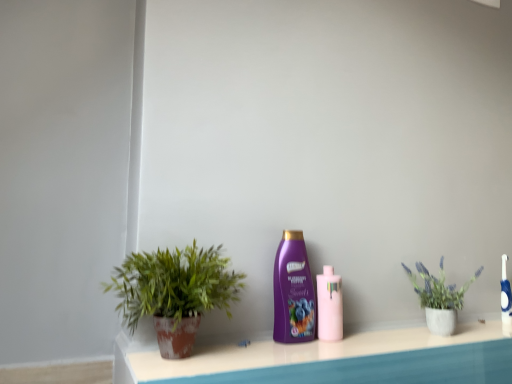
This screenshot has height=384, width=512. I want to click on green matte plant pot at left, which ranks as the second houseplant in right-to-left order, so click(x=174, y=292).

Consider the image. Measure the distance between point (304,275) and camera.

Point (304,275) and camera are 3.55 feet apart from each other.

How much space does purple glossy shampoo at center, placed as the second bottle when sorted from right to left, occupy horizontally?

The width of purple glossy shampoo at center, placed as the second bottle when sorted from right to left, is 2.68 inches.

Image resolution: width=512 pixels, height=384 pixels. I want to click on matte concrete pot at right, positioned as the 1th houseplant in back-to-front order, so click(439, 298).

Where is `pink glossy bottle at center, the first bottle viewed from the right`? The height and width of the screenshot is (384, 512). pink glossy bottle at center, the first bottle viewed from the right is located at coordinates (329, 305).

This screenshot has width=512, height=384. I want to click on blue glossy toothbrush at right, so click(506, 300).

Where is `green matte plant pot at left, which ranks as the second houseplant in right-to-left order`? Image resolution: width=512 pixels, height=384 pixels. green matte plant pot at left, which ranks as the second houseplant in right-to-left order is located at coordinates (174, 292).

In order to click on houseplant located in front of the purple glossy shampoo at center, the 1th bottle when ordered from left to right in this screenshot , I will do `click(174, 292)`.

Which is more to the right, purple glossy shampoo at center, the 1th bottle when ordered from left to right, or green matte plant pot at left, the first houseplant in the left-to-right sequence?

From the viewer's perspective, purple glossy shampoo at center, the 1th bottle when ordered from left to right, appears more on the right side.

Is purple glossy shampoo at center, placed as the second bottle when sorted from right to left, turned away from green matte plant pot at left, which is the 1th houseplant in front-to-back order?

No, purple glossy shampoo at center, placed as the second bottle when sorted from right to left, is not facing the opposite direction of green matte plant pot at left, which is the 1th houseplant in front-to-back order.

In the scene shown: Is purple glossy shampoo at center, the 1th bottle when ordered from left to right, completely or partially outside of green matte plant pot at left, the first houseplant in the left-to-right sequence?

purple glossy shampoo at center, the 1th bottle when ordered from left to right, is positioned outside green matte plant pot at left, the first houseplant in the left-to-right sequence.

Is matte concrete pot at right, which is the second houseplant in left-to-right order, facing away from blue glossy toothbrush at right?

No, blue glossy toothbrush at right is not at the back of matte concrete pot at right, which is the second houseplant in left-to-right order.

Between matte concrete pot at right, positioned as the 1th houseplant in back-to-front order, and blue glossy toothbrush at right, which one has less height?

With less height is blue glossy toothbrush at right.

Does matte concrete pot at right, which is the 1th houseplant in right-to-left order, have a larger size compared to blue glossy toothbrush at right?

Yes, matte concrete pot at right, which is the 1th houseplant in right-to-left order, is bigger than blue glossy toothbrush at right.

Between matte concrete pot at right, positioned as the 1th houseplant in back-to-front order, and blue glossy toothbrush at right, which one is positioned behind?

Positioned behind is blue glossy toothbrush at right.

From a real-world perspective, which object stands above the other?

In real-world perspective, green matte plant pot at left, which is the 1th houseplant in front-to-back order, is above.

From their relative heights in the image, would you say green matte plant pot at left, the second houseplant in the back-to-front sequence, is taller or shorter than matte concrete pot at right, positioned as the 1th houseplant in back-to-front order?

Considering their sizes, green matte plant pot at left, the second houseplant in the back-to-front sequence, has more height than matte concrete pot at right, positioned as the 1th houseplant in back-to-front order.

Is green matte plant pot at left, the first houseplant in the left-to-right sequence, behind matte concrete pot at right, positioned as the 1th houseplant in back-to-front order?

No, green matte plant pot at left, the first houseplant in the left-to-right sequence, is closer to the viewer.

Looking at this image, from a real-world perspective, which object rests below the other?

pink glossy bottle at center, the first bottle viewed from the right.

Considering their positions, is blue glossy toothbrush at right located in front of or behind pink glossy bottle at center, the first bottle viewed from the right?

In the image, blue glossy toothbrush at right appears behind pink glossy bottle at center, the first bottle viewed from the right.

Where is `the 1st bottle to the left when counting from the blue glossy toothbrush at right`? the 1st bottle to the left when counting from the blue glossy toothbrush at right is located at coordinates (329, 305).

The width and height of the screenshot is (512, 384). I want to click on the 1st bottle to the left of the matte concrete pot at right, arranged as the 2th houseplant when viewed from the front, starting your count from the anchor, so click(x=329, y=305).

From the image's perspective, who appears lower, matte concrete pot at right, which is the 1th houseplant in right-to-left order, or pink glossy bottle at center, the first bottle viewed from the right?

pink glossy bottle at center, the first bottle viewed from the right, from the image's perspective.

Is matte concrete pot at right, positioned as the 1th houseplant in back-to-front order, taller than pink glossy bottle at center, acting as the 2th bottle starting from the left?

Correct, matte concrete pot at right, positioned as the 1th houseplant in back-to-front order, is much taller as pink glossy bottle at center, acting as the 2th bottle starting from the left.

Is point (431, 311) less distant than point (322, 301)?

That is False.

Is pink glossy bottle at center, the first bottle viewed from the right, taller or shorter than blue glossy toothbrush at right?

In the image, pink glossy bottle at center, the first bottle viewed from the right, appears to be shorter than blue glossy toothbrush at right.

Which is farther, (341, 334) or (502, 295)?

Positioned behind is point (502, 295).

Between pink glossy bottle at center, the first bottle viewed from the right, and blue glossy toothbrush at right, which one has smaller size?

With smaller size is blue glossy toothbrush at right.

From a real-world perspective, between pink glossy bottle at center, the first bottle viewed from the right, and blue glossy toothbrush at right, who is vertically lower?

In real-world perspective, pink glossy bottle at center, the first bottle viewed from the right, is lower.

Is purple glossy shampoo at center, placed as the second bottle when sorted from right to left, at the back of pink glossy bottle at center, acting as the 2th bottle starting from the left?

pink glossy bottle at center, acting as the 2th bottle starting from the left, is not turned away from purple glossy shampoo at center, placed as the second bottle when sorted from right to left.

Looking at the image, does pink glossy bottle at center, acting as the 2th bottle starting from the left, seem bigger or smaller compared to purple glossy shampoo at center, placed as the second bottle when sorted from right to left?

Considering their sizes, pink glossy bottle at center, acting as the 2th bottle starting from the left, takes up less space than purple glossy shampoo at center, placed as the second bottle when sorted from right to left.

Can you confirm if pink glossy bottle at center, the first bottle viewed from the right, is taller than purple glossy shampoo at center, the 1th bottle when ordered from left to right?

No, pink glossy bottle at center, the first bottle viewed from the right, is not taller than purple glossy shampoo at center, the 1th bottle when ordered from left to right.

Considering the positions of objects pink glossy bottle at center, acting as the 2th bottle starting from the left, and purple glossy shampoo at center, the 1th bottle when ordered from left to right, in the image provided, who is more to the right, pink glossy bottle at center, acting as the 2th bottle starting from the left, or purple glossy shampoo at center, the 1th bottle when ordered from left to right,?

From the viewer's perspective, pink glossy bottle at center, acting as the 2th bottle starting from the left, appears more on the right side.

Locate an element on the screen. Image resolution: width=512 pixels, height=384 pixels. houseplant that appears in front of the purple glossy shampoo at center, placed as the second bottle when sorted from right to left is located at coordinates pyautogui.click(x=174, y=292).

This screenshot has height=384, width=512. Find the location of `mouthwash located behind the matte concrete pot at right, arranged as the 2th houseplant when viewed from the front`. mouthwash located behind the matte concrete pot at right, arranged as the 2th houseplant when viewed from the front is located at coordinates (506, 300).

Which object lies further to the anchor point purple glossy shampoo at center, placed as the second bottle when sorted from right to left, green matte plant pot at left, which ranks as the second houseplant in right-to-left order, or pink glossy bottle at center, the first bottle viewed from the right?

The object further to purple glossy shampoo at center, placed as the second bottle when sorted from right to left, is green matte plant pot at left, which ranks as the second houseplant in right-to-left order.

When comparing their distances from purple glossy shampoo at center, placed as the second bottle when sorted from right to left, does blue glossy toothbrush at right or pink glossy bottle at center, acting as the 2th bottle starting from the left, seem further?

blue glossy toothbrush at right lies further to purple glossy shampoo at center, placed as the second bottle when sorted from right to left, than the other object.

From the picture: Estimate the real-world distances between objects in this image. Which object is further from pink glossy bottle at center, the first bottle viewed from the right, blue glossy toothbrush at right or green matte plant pot at left, which ranks as the second houseplant in right-to-left order?

The object further to pink glossy bottle at center, the first bottle viewed from the right, is blue glossy toothbrush at right.

Looking at the image, which one is located closer to green matte plant pot at left, the second houseplant in the back-to-front sequence, blue glossy toothbrush at right or purple glossy shampoo at center, the 1th bottle when ordered from left to right?

purple glossy shampoo at center, the 1th bottle when ordered from left to right.

From the image, which object appears to be nearer to blue glossy toothbrush at right, pink glossy bottle at center, the first bottle viewed from the right, or purple glossy shampoo at center, the 1th bottle when ordered from left to right?

pink glossy bottle at center, the first bottle viewed from the right, is positioned closer to the anchor blue glossy toothbrush at right.

When comparing their distances from matte concrete pot at right, which is the second houseplant in left-to-right order, does pink glossy bottle at center, the first bottle viewed from the right, or blue glossy toothbrush at right seem closer?

The object closer to matte concrete pot at right, which is the second houseplant in left-to-right order, is blue glossy toothbrush at right.

Based on their spatial positions, is blue glossy toothbrush at right or matte concrete pot at right, arranged as the 2th houseplant when viewed from the front, closer to pink glossy bottle at center, acting as the 2th bottle starting from the left?

Among the two, matte concrete pot at right, arranged as the 2th houseplant when viewed from the front, is located nearer to pink glossy bottle at center, acting as the 2th bottle starting from the left.

Based on their spatial positions, is matte concrete pot at right, positioned as the 1th houseplant in back-to-front order, or green matte plant pot at left, the first houseplant in the left-to-right sequence, further from blue glossy toothbrush at right?

green matte plant pot at left, the first houseplant in the left-to-right sequence.

The image size is (512, 384). I want to click on houseplant between purple glossy shampoo at center, the 1th bottle when ordered from left to right, and blue glossy toothbrush at right from left to right, so click(439, 298).

The image size is (512, 384). Identify the location of houseplant between pink glossy bottle at center, acting as the 2th bottle starting from the left, and blue glossy toothbrush at right. (439, 298).

Identify the location of houseplant between green matte plant pot at left, which ranks as the second houseplant in right-to-left order, and blue glossy toothbrush at right from left to right. Image resolution: width=512 pixels, height=384 pixels. (439, 298).

Locate an element on the screen. This screenshot has width=512, height=384. bottle between purple glossy shampoo at center, the 1th bottle when ordered from left to right, and blue glossy toothbrush at right from left to right is located at coordinates (329, 305).